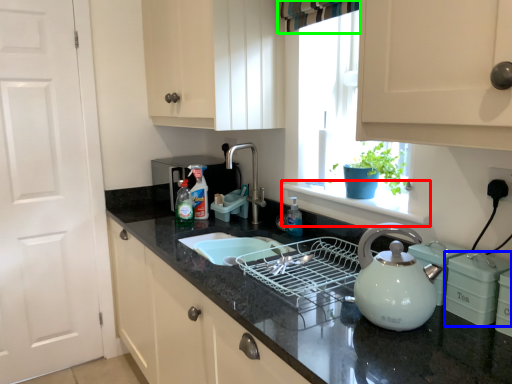
Question: Based on their relative distances, which object is farther from window sill (highlighted by a red box)? Choose from appliance (highlighted by a blue box) and curtain (highlighted by a green box).

Choices:
 (A) appliance
 (B) curtain

Answer: (B)